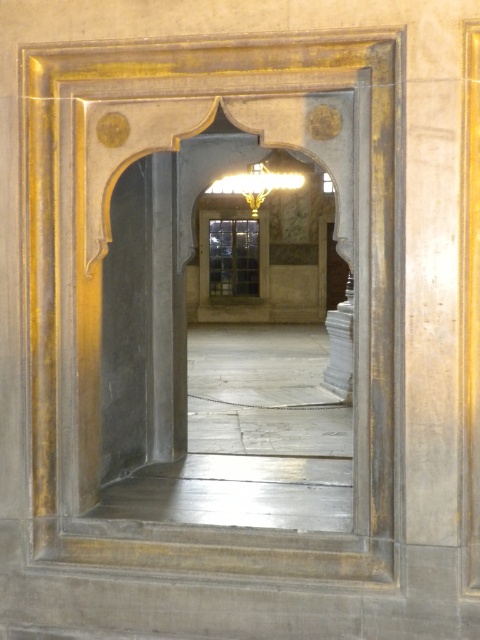
In the scene shown: You are an interior designer planning to install a new light fixture that is 2 meters tall. You see the gold polished stone archway at center and the gold metallic chandelier at center. Which object can accommodate the new fixture without blocking the view through the archway?

The gold polished stone archway at center is taller than the gold metallic chandelier at center, so the new light fixture can be installed under the archway without blocking the view since the archway is taller.

You are standing in the corridor and want to touch both the gold polished stone archway at center and the gold metallic chandelier at center. Which one can you reach first without moving your feet?

The gold polished stone archway at center is closer to the viewer than the gold metallic chandelier at center, so you can reach it first without moving your feet.

You are standing in the corridor and want to take a photo of the gold polished stone archway at center. If your camera has a maximum focus range of 3 meters, will it be able to capture the archway clearly?

The distance of gold polished stone archway at center from camera is 3.39 meters, which exceeds the camera maximum focus range of 3 meters. Therefore, the camera may not be able to capture the archway clearly.